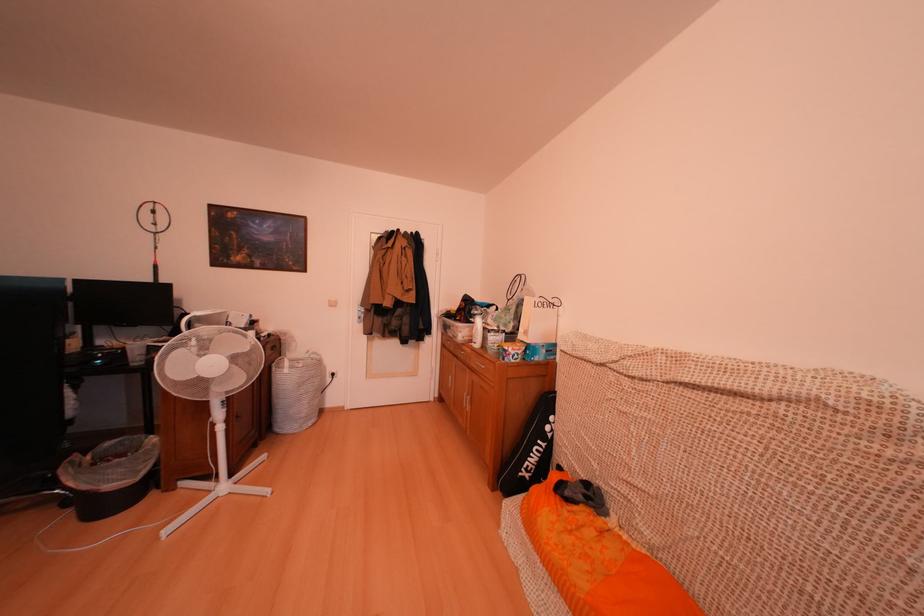
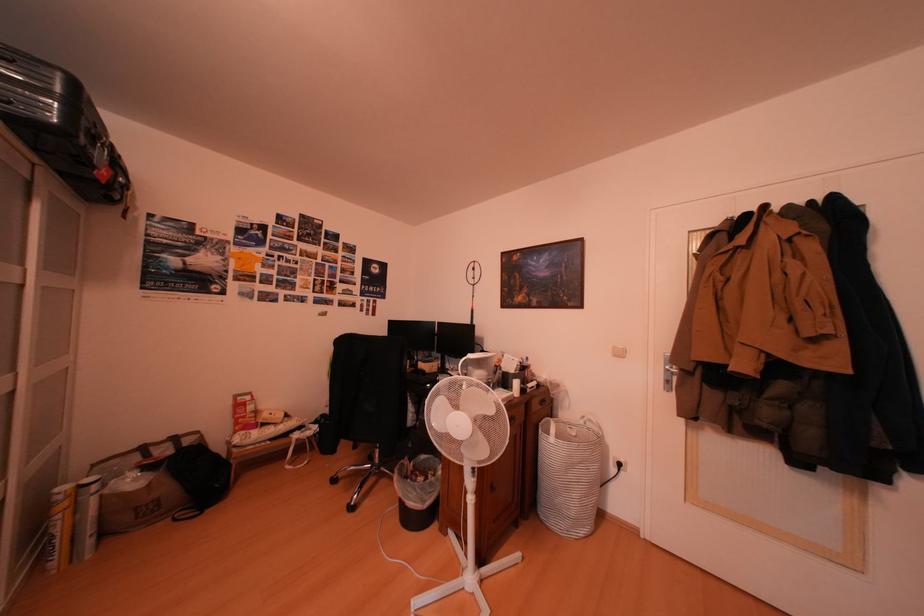
Where in the second image is the point corresponding to the point at 122,448 from the first image?

(435, 463)